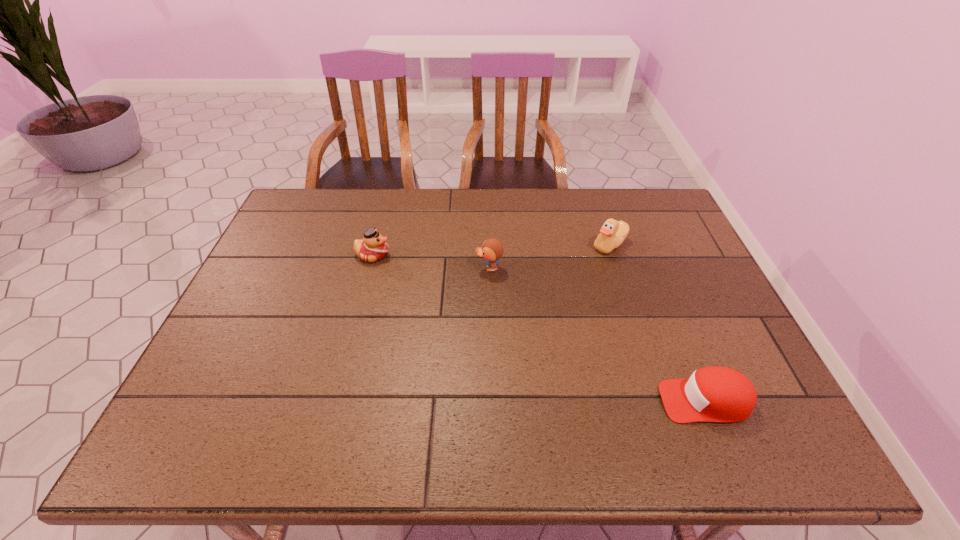
You are a GUI agent. You are given a task and a screenshot of the screen. Output one action in this format:
    pyautogui.click(x=<x>, y=<y>)
    Task: Click on the vacant space situated 0.230m on the front-facing side of the second object from left to right
    The height and width of the screenshot is (540, 960).
    Given the screenshot: What is the action you would take?
    point(396,268)

Find the location of a particular element. The height and width of the screenshot is (540, 960). free space located on the face of the leftmost object is located at coordinates 517,255.

The height and width of the screenshot is (540, 960). What are the coordinates of `free space located 0.130m on the front-facing side of the shortest object` in the screenshot? It's located at (601, 401).

This screenshot has height=540, width=960. Find the location of `blank space located on the front-facing side of the shortest object`. blank space located on the front-facing side of the shortest object is located at coordinates (564, 401).

You are a GUI agent. You are given a task and a screenshot of the screen. Output one action in this format:
    pyautogui.click(x=<x>, y=<y>)
    Task: Click on the vacant space located 0.230m on the front-facing side of the shortest object
    
    Given the screenshot: What is the action you would take?
    pyautogui.click(x=556, y=401)

Locate an element on the screen. The width and height of the screenshot is (960, 540). object present at the near edge is located at coordinates (712, 394).

The image size is (960, 540). Identify the location of object present at the right edge. (712, 394).

This screenshot has width=960, height=540. Identify the location of object present at the near right corner. (712, 394).

I want to click on free location at the far edge of the desktop, so click(530, 200).

This screenshot has height=540, width=960. What are the coordinates of `blank space at the near edge of the desktop` in the screenshot? It's located at (378, 424).